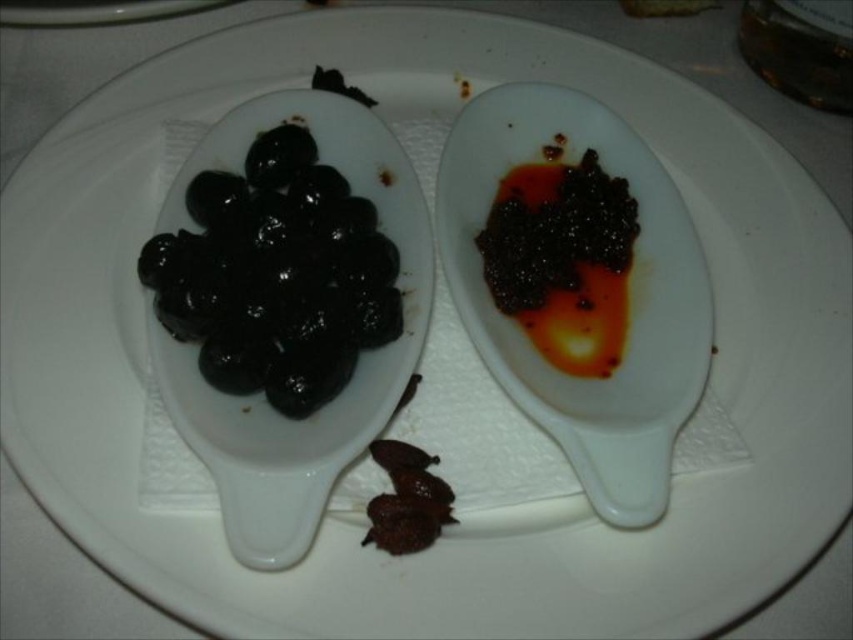
Question: Which object is the farthest from the shiny black caviar at right?

Choices:
 (A) shiny brown olives at lower center
 (B) white glossy spoon at upper right
 (C) black glossy olives at left

Answer: (A)

Question: Is black glossy olives at left thinner than shiny brown olives at lower center?

Choices:
 (A) no
 (B) yes

Answer: (A)

Question: Which object appears closest to the camera in this image?

Choices:
 (A) black glossy olives at left
 (B) white glossy spoon at upper right
 (C) shiny black caviar at right

Answer: (B)

Question: Considering the relative positions of white glossy spoon at upper right and black glossy olives at left in the image provided, where is white glossy spoon at upper right located with respect to black glossy olives at left?

Choices:
 (A) above
 (B) below

Answer: (B)

Question: Considering the real-world distances, which object is closest to the shiny brown olives at lower center?

Choices:
 (A) shiny black caviar at right
 (B) white glossy spoon at upper right

Answer: (B)

Question: Does black glossy olives at left appear on the left side of shiny brown olives at lower center?

Choices:
 (A) yes
 (B) no

Answer: (A)